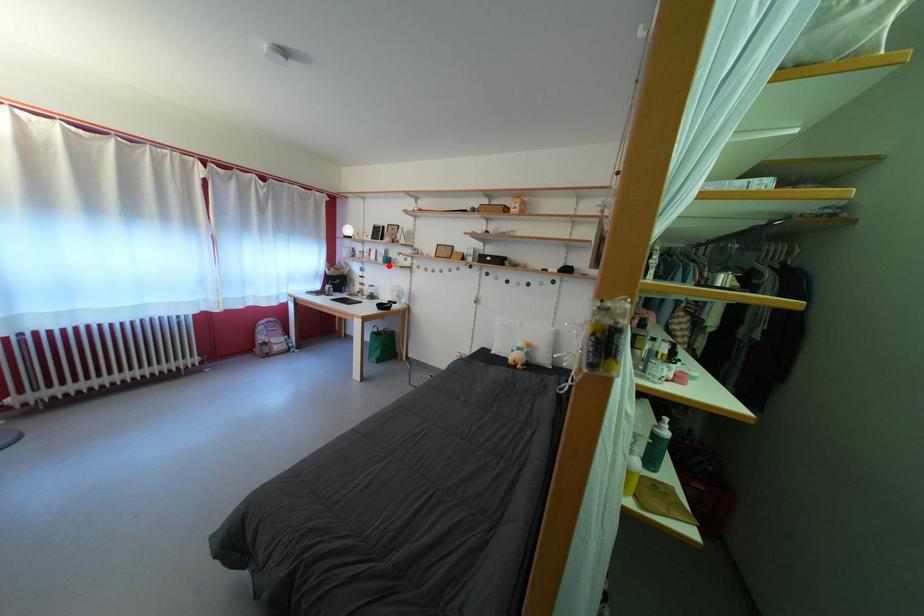
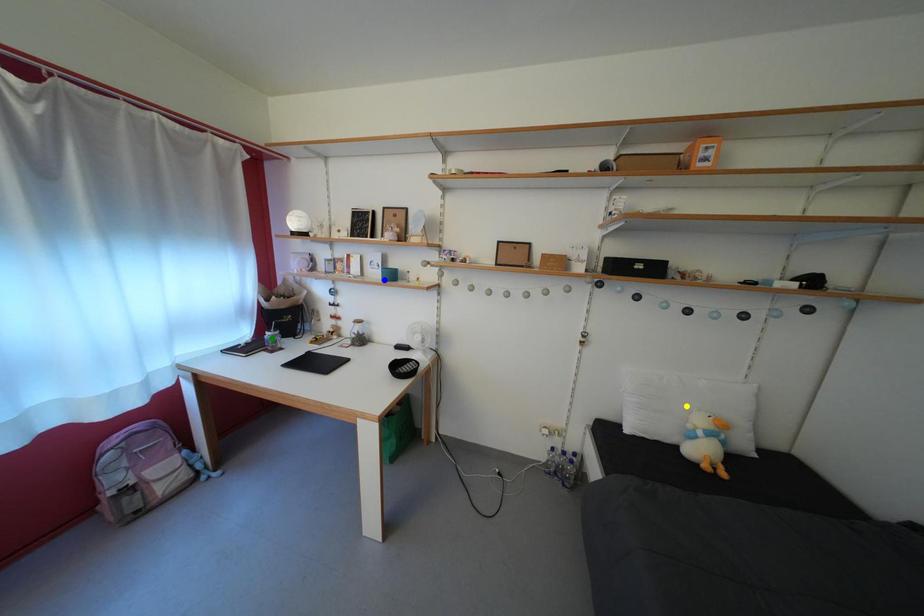
Question: I am providing you with two images of the same scene from different viewpoints. A red point is marked on the first image. You are given multiple points on the second image. In image 2, which mark is for the same physical point as the one in image 1?

Choices:
 (A) green point
 (B) blue point
 (C) yellow point

Answer: (B)